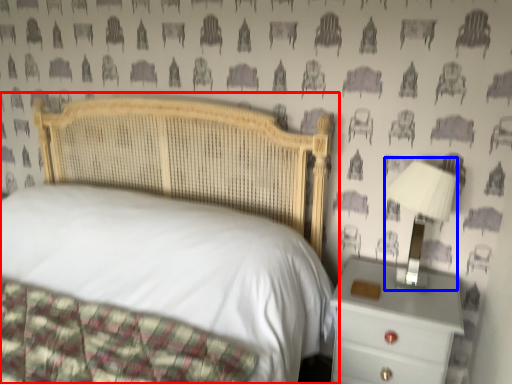
Question: Which of the following is the farthest to the observer, bed (highlighted by a red box) or bedside lamp (highlighted by a blue box)?

Choices:
 (A) bed
 (B) bedside lamp

Answer: (B)